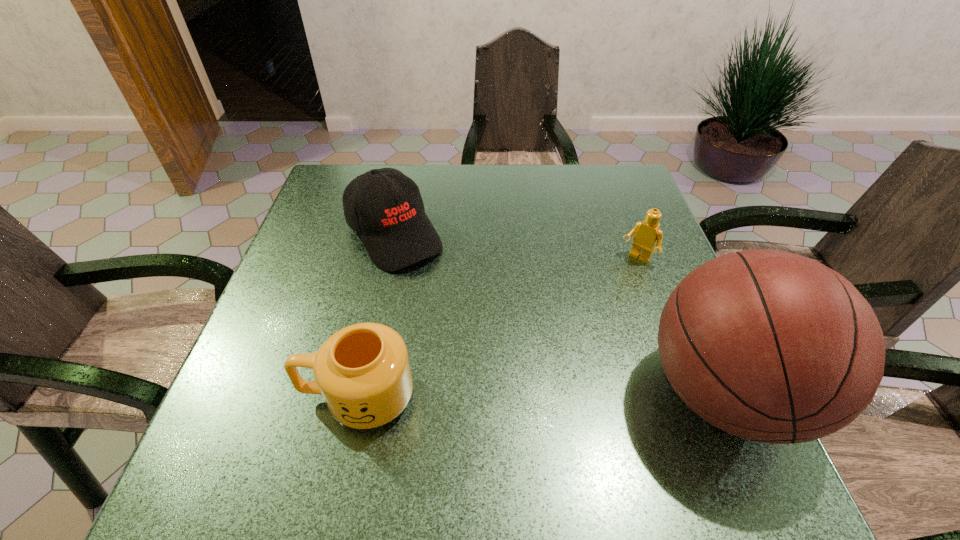
Find the location of a particular element. mug is located at coordinates (363, 371).

Where is `basketball`? The height and width of the screenshot is (540, 960). basketball is located at coordinates (770, 346).

Where is `Lego`? Lego is located at coordinates (648, 233).

Identify the location of baseball cap. The height and width of the screenshot is (540, 960). (384, 206).

Find the location of `blank space located 0.140m on the handle side of the mug`. blank space located 0.140m on the handle side of the mug is located at coordinates (226, 397).

At what (x,y) coordinates should I click in order to perform the action: click on free space located 0.050m on the handle side of the mug. Please return your answer as a coordinate pair (x, y). Image resolution: width=960 pixels, height=540 pixels. Looking at the image, I should click on (275, 397).

Where is `vacant space located 0.280m on the back of the tallest object`? The height and width of the screenshot is (540, 960). vacant space located 0.280m on the back of the tallest object is located at coordinates (658, 241).

Identify the location of vacant space located 0.330m on the face of the Lego. Image resolution: width=960 pixels, height=540 pixels. coord(559,357).

Locate an element on the screen. blank space located 0.050m on the face of the Lego is located at coordinates (620, 278).

The width and height of the screenshot is (960, 540). Find the location of `free spot located 0.070m on the face of the Lego`. free spot located 0.070m on the face of the Lego is located at coordinates (616, 283).